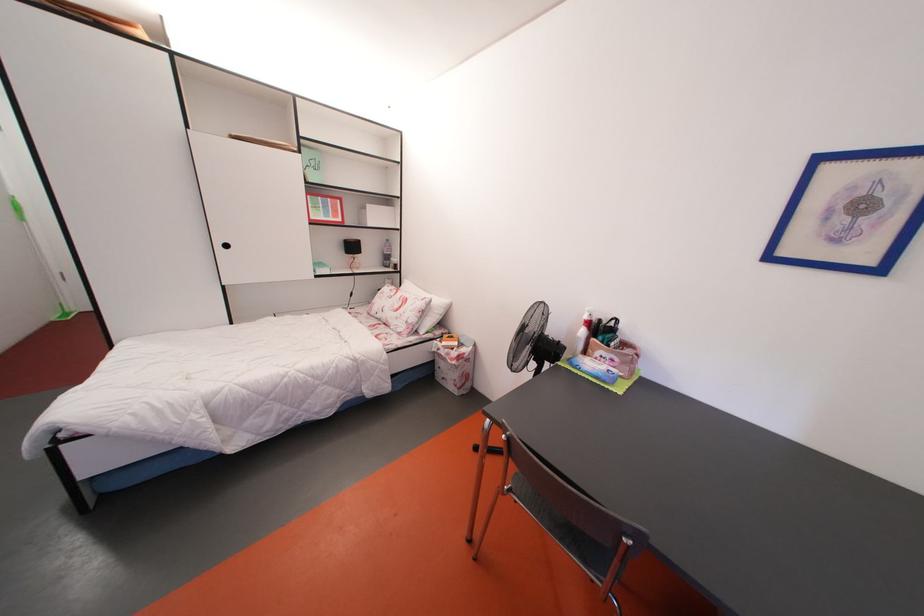
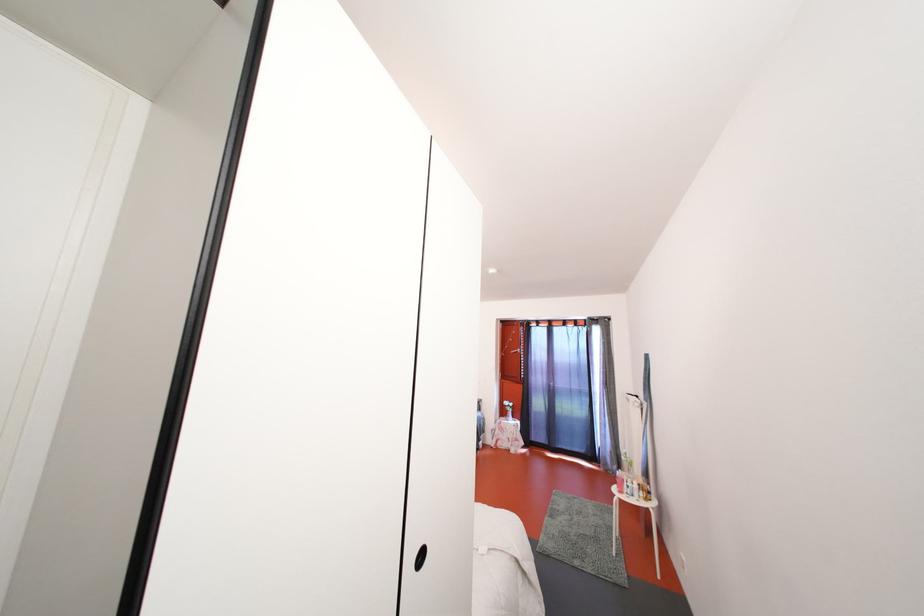
Question: I am providing you with two images of the same scene from different viewpoints. After the viewpoint changes to image2, which objects are now occluded?

Choices:
 (A) chair sitting surface
 (B) small white vase
 (C) silver wardrobe handle
 (D) white pump bottle

Answer: (A)